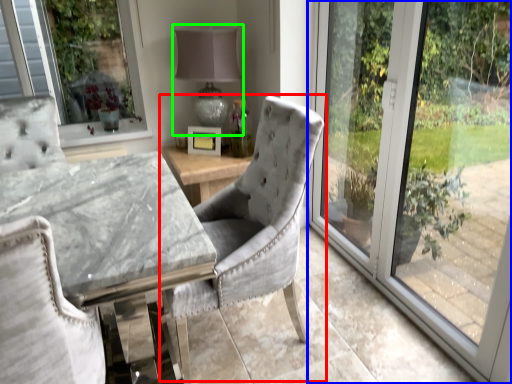
Question: Considering the real-world distances, which object is farthest from chair (highlighted by a red box)? window (highlighted by a blue box) or table lamp (highlighted by a green box)?

Choices:
 (A) window
 (B) table lamp

Answer: (B)